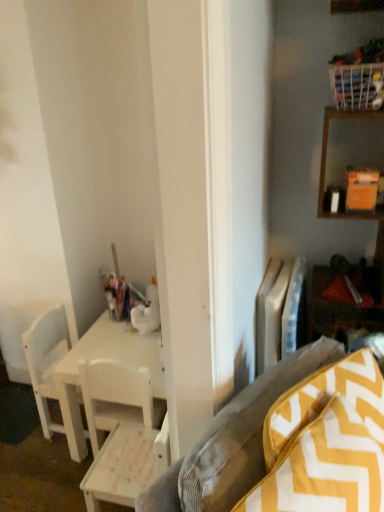
Question: From a real-world perspective, relative to white plastic radiator at center right, is white wood chair at lower left, which is counted as the 1th chair, starting from the right, vertically above or below?

Choices:
 (A) below
 (B) above

Answer: (A)

Question: Relative to white plastic radiator at center right, is white wood chair at lower left, the 2th chair in the back-to-front sequence, in front or behind?

Choices:
 (A) front
 (B) behind

Answer: (A)

Question: Which of these objects is positioned closest to the white wood desk at center?

Choices:
 (A) white wood chair at lower left, acting as the 1th chair starting from the front
 (B) white plastic radiator at center right
 (C) yellow zigzag-patterned cushion at lower right
 (D) white matte chair at left, the second chair when ordered from right to left

Answer: (A)

Question: Estimate the real-world distances between objects in this image. Which object is closer to the white matte chair at left, the second chair positioned from the front?

Choices:
 (A) white wood chair at lower left, the 2th chair in the back-to-front sequence
 (B) yellow zigzag-patterned cushion at lower right
 (C) white wood desk at center
 (D) white plastic radiator at center right

Answer: (C)